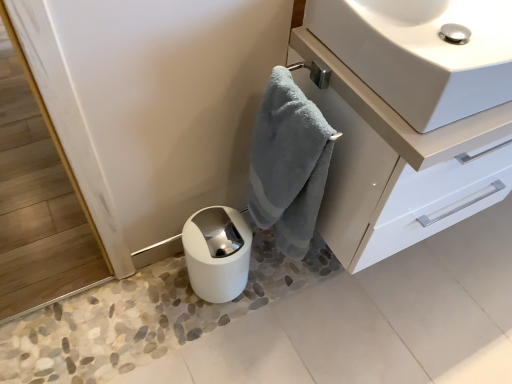
Question: Does soft blue towel at center have a smaller size compared to white glossy sink at upper right?

Choices:
 (A) yes
 (B) no

Answer: (A)

Question: Does soft blue towel at center have a lesser width compared to white glossy sink at upper right?

Choices:
 (A) yes
 (B) no

Answer: (A)

Question: Is soft blue towel at center positioned with its back to white glossy sink at upper right?

Choices:
 (A) yes
 (B) no

Answer: (A)

Question: Is soft blue towel at center positioned in front of white glossy sink at upper right?

Choices:
 (A) no
 (B) yes

Answer: (A)

Question: Considering the relative positions of soft blue towel at center and white glossy sink at upper right in the image provided, is soft blue towel at center to the right of white glossy sink at upper right from the viewer's perspective?

Choices:
 (A) yes
 (B) no

Answer: (B)

Question: From the image's perspective, is glossy white cabinet at upper right located above or below soft blue towel at center?

Choices:
 (A) above
 (B) below

Answer: (A)

Question: Would you say glossy white cabinet at upper right is inside or outside soft blue towel at center?

Choices:
 (A) inside
 (B) outside

Answer: (B)

Question: Considering the positions of point (373, 140) and point (323, 117), is point (373, 140) closer or farther from the camera than point (323, 117)?

Choices:
 (A) farther
 (B) closer

Answer: (B)

Question: Is glossy white cabinet at upper right to the left or to the right of soft blue towel at center in the image?

Choices:
 (A) left
 (B) right

Answer: (B)

Question: Visually, is white glossy paper towel at lower center positioned to the left or to the right of glossy white cabinet at upper right?

Choices:
 (A) left
 (B) right

Answer: (A)

Question: Is point (187, 261) closer or farther from the camera than point (325, 56)?

Choices:
 (A) closer
 (B) farther

Answer: (B)

Question: Is white glossy paper towel at lower center spatially inside glossy white cabinet at upper right, or outside of it?

Choices:
 (A) outside
 (B) inside

Answer: (A)

Question: In terms of width, does white glossy paper towel at lower center look wider or thinner when compared to glossy white cabinet at upper right?

Choices:
 (A) thin
 (B) wide

Answer: (A)

Question: Would you say white glossy sink at upper right is to the left or to the right of soft blue towel at center in the picture?

Choices:
 (A) left
 (B) right

Answer: (B)

Question: Is white glossy sink at upper right bigger or smaller than soft blue towel at center?

Choices:
 (A) small
 (B) big

Answer: (B)